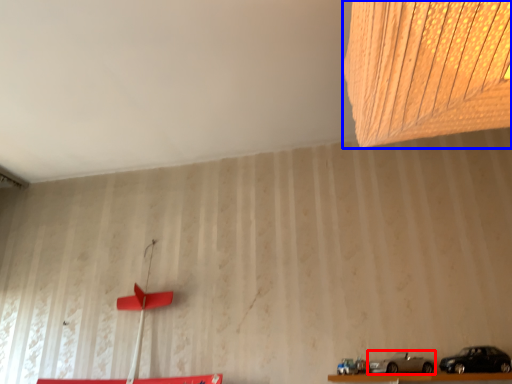
Question: Which point is further to the camera, car (highlighted by a red box) or lamp (highlighted by a blue box)?

Choices:
 (A) car
 (B) lamp

Answer: (A)